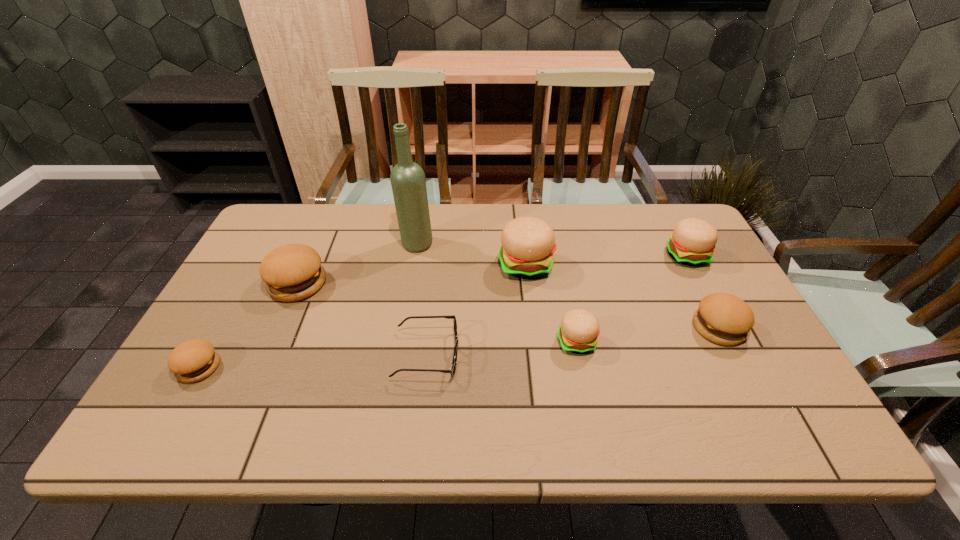
The width and height of the screenshot is (960, 540). In order to click on the smallest brown hamburger in this screenshot , I will do `click(192, 361)`.

Where is `the shortest hamburger`? The image size is (960, 540). the shortest hamburger is located at coordinates (192, 361).

This screenshot has height=540, width=960. Identify the location of the shortest object. (452, 370).

Where is `vacant area situated on the front of the green wine bottle`? The height and width of the screenshot is (540, 960). vacant area situated on the front of the green wine bottle is located at coordinates (406, 309).

At what (x,y) coordinates should I click in order to perform the action: click on free space located on the right of the second tallest object. Please return your answer as a coordinate pair (x, y). This screenshot has width=960, height=540. Looking at the image, I should click on (617, 265).

Where is `vacant region located 0.140m on the front of the rightmost beige hamburger`? vacant region located 0.140m on the front of the rightmost beige hamburger is located at coordinates (712, 305).

Identify the location of vacant area situated 0.200m on the back of the seventh object from right to left. This screenshot has height=540, width=960. (324, 225).

Find the location of a particular element. vacant space positioned 0.180m on the back of the second farthest brown hamburger is located at coordinates (685, 265).

Where is `vacant region located 0.210m on the left of the nearest beige hamburger`? This screenshot has height=540, width=960. vacant region located 0.210m on the left of the nearest beige hamburger is located at coordinates (473, 341).

Where is `free point located 0.070m on the front of the shortest hamburger`? free point located 0.070m on the front of the shortest hamburger is located at coordinates (174, 413).